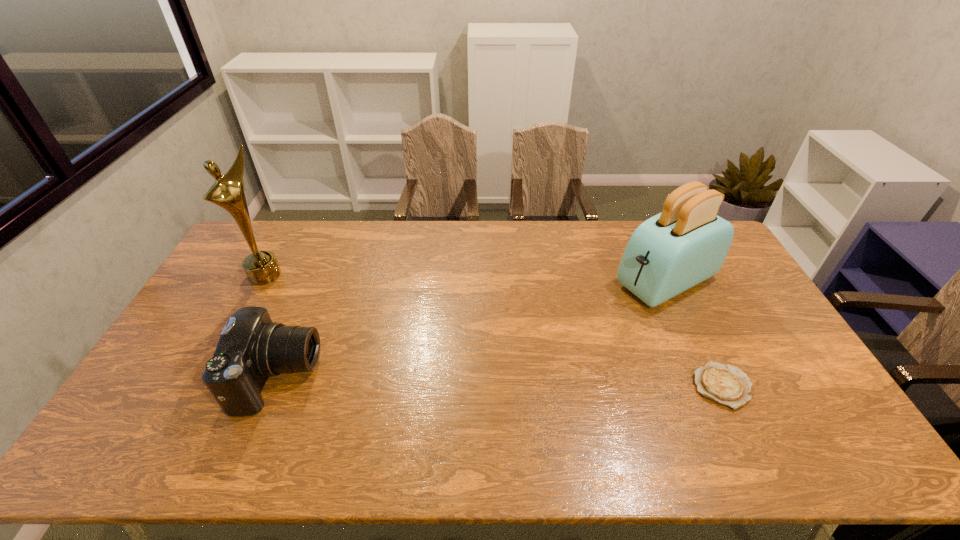
At what (x,y) coordinates should I click in order to perform the action: click on free spot on the desktop that is between the camera and the shortest object and is positioned on the side of the second tallest object with the lever. Please return your answer as a coordinate pair (x, y). Looking at the image, I should click on (471, 381).

The image size is (960, 540). Find the location of `free space on the desktop that is between the camera and the quiche and is positioned on the front-facing side of the leftmost object`. free space on the desktop that is between the camera and the quiche and is positioned on the front-facing side of the leftmost object is located at coordinates (441, 380).